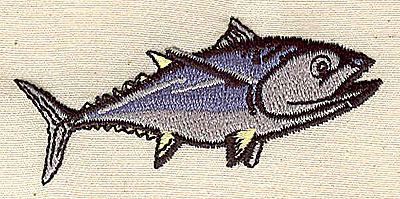
The width and height of the screenshot is (400, 199). I want to click on embroidery, so point(314,115).